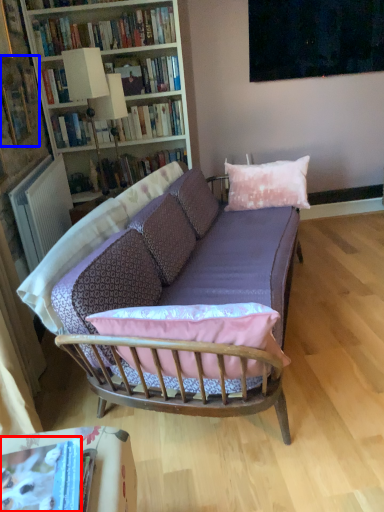
Question: Which object appears farthest to the camera in this image, book (highlighted by a red box) or book (highlighted by a blue box)?

Choices:
 (A) book
 (B) book

Answer: (B)